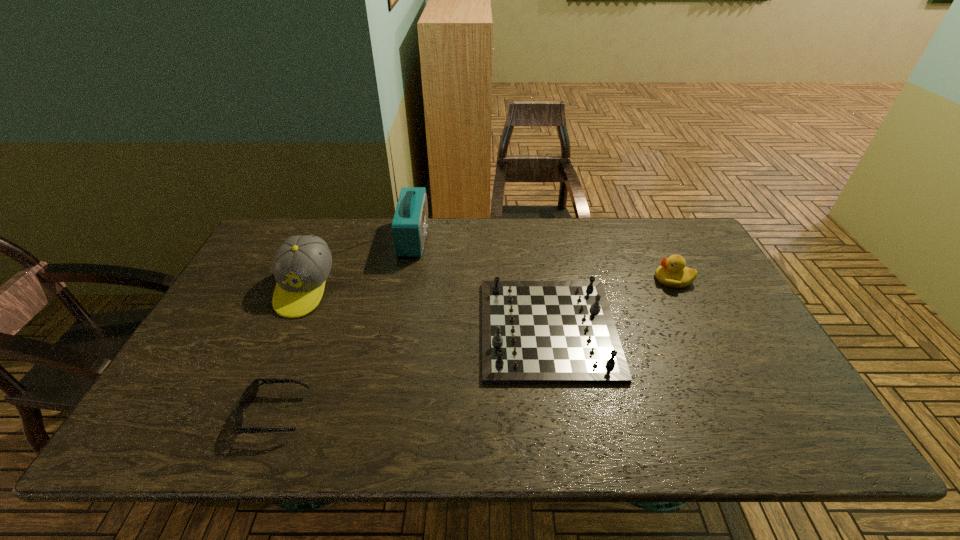
Locate an element on the screen. The width and height of the screenshot is (960, 540). object located in the left edge section of the desktop is located at coordinates (302, 264).

In order to click on object located at the right edge in this screenshot , I will do `click(672, 272)`.

The width and height of the screenshot is (960, 540). I want to click on free space at the far edge, so [357, 218].

At what (x,y) coordinates should I click in order to perform the action: click on vacant area at the near edge. Please return your answer as a coordinate pair (x, y). Looking at the image, I should click on pyautogui.click(x=713, y=448).

Identify the location of vacant region at the left edge of the desktop. Image resolution: width=960 pixels, height=540 pixels. (267, 300).

You are a GUI agent. You are given a task and a screenshot of the screen. Output one action in this format:
    pyautogui.click(x=<x>, y=<y>)
    Task: Click on the free space at the far left corner
    The height and width of the screenshot is (540, 960).
    Given the screenshot: What is the action you would take?
    pos(298,233)

Locate an element on the screen. vacant space at the far right corner of the desktop is located at coordinates (677, 248).

Where is `vacant space at the near right corner of the desktop`? The width and height of the screenshot is (960, 540). vacant space at the near right corner of the desktop is located at coordinates (755, 437).

Image resolution: width=960 pixels, height=540 pixels. I want to click on unoccupied position between the third shortest object and the second object from right to left, so click(611, 304).

I want to click on free space that is in between the sunglasses and the baseball cap, so [291, 350].